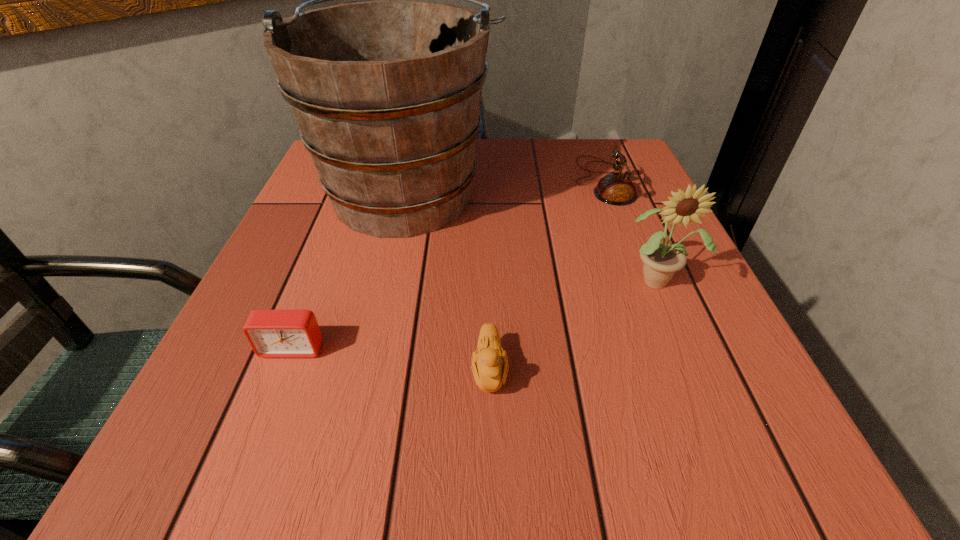
Image resolution: width=960 pixels, height=540 pixels. Identify the location of vacant space at the far edge of the desktop. (552, 145).

At what (x,y) coordinates should I click in order to perform the action: click on free space at the near edge of the desktop. Please return your answer as a coordinate pair (x, y). Looking at the image, I should click on (543, 477).

Identify the location of vacant position at the left edge of the desktop. (350, 249).

The height and width of the screenshot is (540, 960). In the image, there is a desktop. Identify the location of free space at the right edge. (708, 399).

I want to click on vacant space at the near left corner of the desktop, so click(x=296, y=429).

This screenshot has width=960, height=540. What are the coordinates of `vacant space at the far right corner` in the screenshot? It's located at (586, 151).

You are a GUI agent. You are given a task and a screenshot of the screen. Output one action in this format:
    pyautogui.click(x=<x>, y=<y>)
    Task: Click on the free space at the near right corner of the desktop
    
    Given the screenshot: What is the action you would take?
    pyautogui.click(x=693, y=466)

Find the location of a particular element. vacant area between the telephone and the second tallest object is located at coordinates (630, 231).

The width and height of the screenshot is (960, 540). I want to click on free space between the sunflower and the bucket, so click(533, 235).

The image size is (960, 540). I want to click on vacant space that is in between the bucket and the sunflower, so click(x=533, y=235).